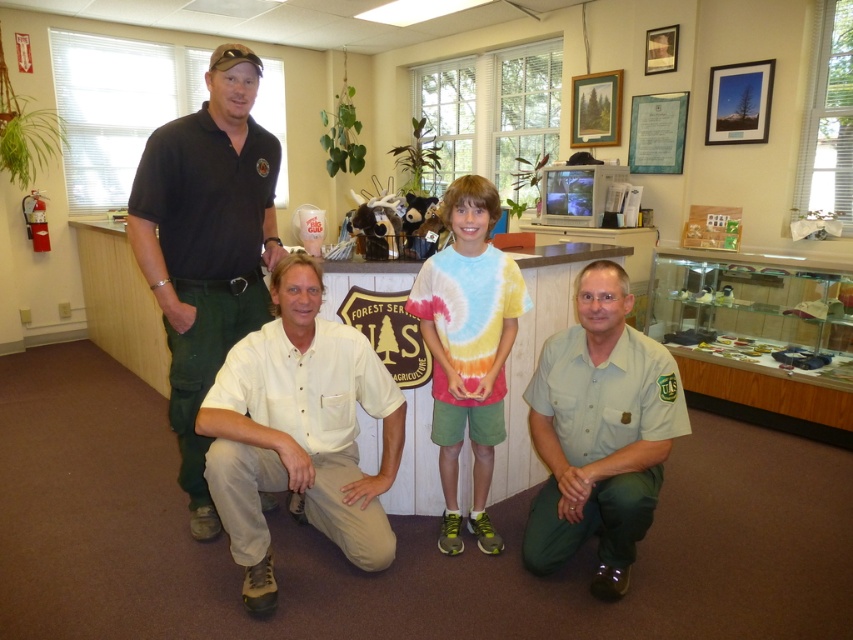
You are a photographer trying to capture a group photo of the two adults and two children in the visitor center. You notice a point at coordinates (607, 440) which marks the white cotton shirt at center. Where should you position your camera to ensure the white cotton shirt at center is clearly visible in the photo?

Position the camera so that it faces directly towards the white cotton shirt at center marked by the point at coordinates (607, 440) to ensure it is clearly visible.

You are standing at the entrance of the visitor center and want to approach the beige cotton shirt at center. Which direction should you move to reach it?

Since the beige cotton shirt at center is located at point 0.677 on the x axis and 0.352 on the y axis, you should move towards the right and slightly forward to reach it.